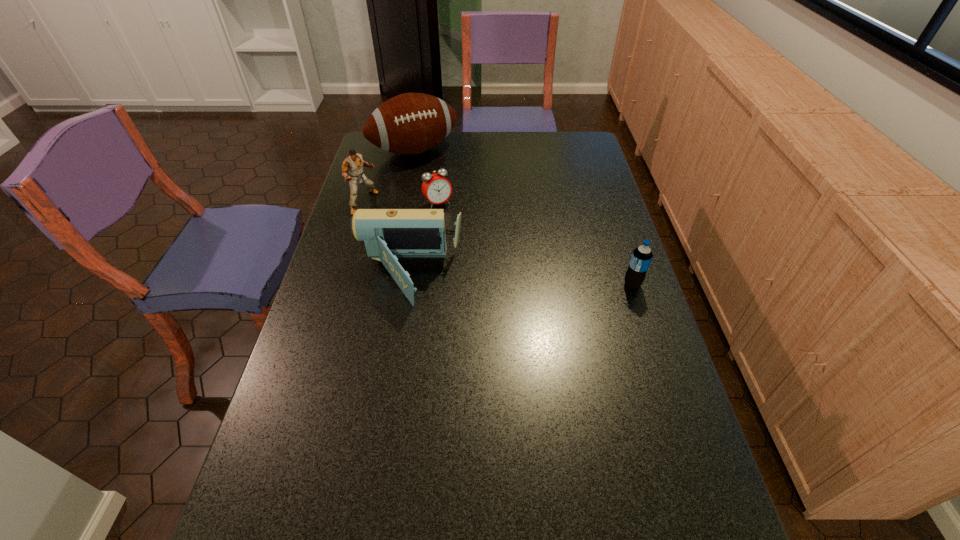
Locate an element on the screen. The image size is (960, 540). vacant region between the rightmost object and the camcorder is located at coordinates (520, 281).

Locate an element on the screen. This screenshot has height=540, width=960. vacant space that's between the puncher and the rightmost object is located at coordinates (498, 244).

This screenshot has width=960, height=540. Find the location of `empty space that is in between the shortest object and the rightmost object`. empty space that is in between the shortest object and the rightmost object is located at coordinates (535, 244).

Where is `vacant space in between the puncher and the football`? This screenshot has width=960, height=540. vacant space in between the puncher and the football is located at coordinates (390, 177).

Select which object appears as the third closest to the camcorder. Please provide its 2D coordinates. Your answer should be formatted as a tuple, i.e. [(x, y)], where the tuple contains the x and y coordinates of a point satisfying the conditions above.

[(641, 257)]

Choose which object is the third nearest neighbor to the camcorder. Please provide its 2D coordinates. Your answer should be formatted as a tuple, i.e. [(x, y)], where the tuple contains the x and y coordinates of a point satisfying the conditions above.

[(641, 257)]

Where is `free point that satisfies the following two spatial constraints: 1. on the front side of the puncher; 2. on the left side of the soda bottle`? Image resolution: width=960 pixels, height=540 pixels. free point that satisfies the following two spatial constraints: 1. on the front side of the puncher; 2. on the left side of the soda bottle is located at coordinates (341, 285).

You are a GUI agent. You are given a task and a screenshot of the screen. Output one action in this format:
    pyautogui.click(x=<x>, y=<y>)
    Task: Click on the free spot that satisfies the following two spatial constraints: 1. on the front side of the puncher; 2. on the side of the camcorder with the flip-out screen
    Image resolution: width=960 pixels, height=540 pixels.
    Given the screenshot: What is the action you would take?
    pyautogui.click(x=343, y=277)

At what (x,y) coordinates should I click in order to perform the action: click on vacant area that satisfies the following two spatial constraints: 1. on the front side of the farthest object; 2. on the left side of the rightmost object. Please return your answer as a coordinate pair (x, y). The height and width of the screenshot is (540, 960). Looking at the image, I should click on (388, 285).